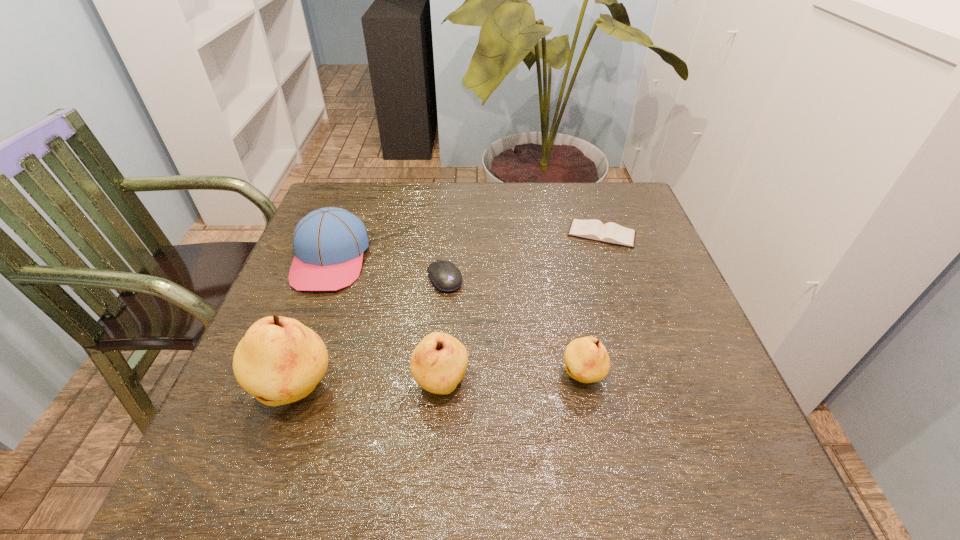
All pears are currently evenly spaced. To continue this pattern, where would you add another pear on the right? Please point out a vacant spot. Please provide its 2D coordinates. Your answer should be formatted as a tuple, i.e. [(x, y)], where the tuple contains the x and y coordinates of a point satisfying the conditions above.

[(719, 370)]